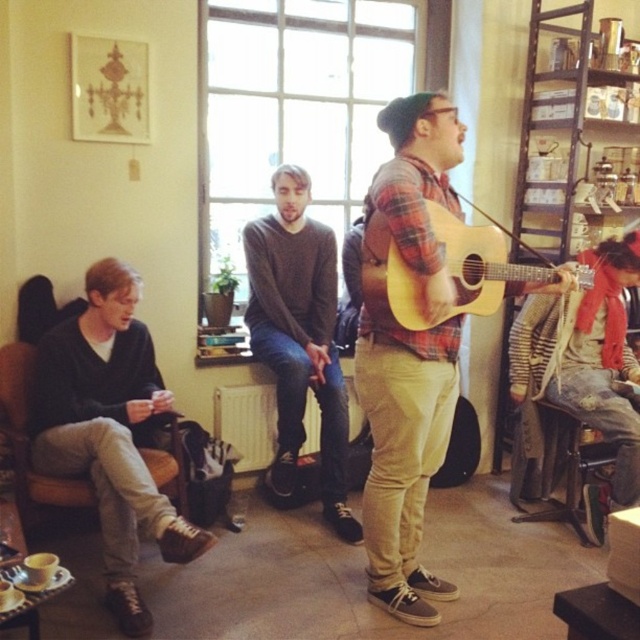
Question: Can you confirm if dark gray sweater at left is positioned above wooden stool at lower right?

Choices:
 (A) no
 (B) yes

Answer: (B)

Question: Which object appears closest to the camera in this image?

Choices:
 (A) dark gray sweater at left
 (B) striped sweater at lower right
 (C) brown leather armchair at left

Answer: (A)

Question: Estimate the real-world distances between objects in this image. Which object is farther from the brown leather armchair at left?

Choices:
 (A) matte plaid shirt at center
 (B) dark gray sweater at left
 (C) wooden stool at lower right
 (D) dark gray sweater at center

Answer: (C)

Question: Is dark gray sweater at left wider than light brown wooden guitar at center?

Choices:
 (A) no
 (B) yes

Answer: (A)

Question: Which object is farther from the camera taking this photo?

Choices:
 (A) dark gray sweater at left
 (B) dark gray sweater at center
 (C) brown leather armchair at left

Answer: (B)

Question: Is matte plaid shirt at center above light brown wooden guitar at center?

Choices:
 (A) no
 (B) yes

Answer: (A)